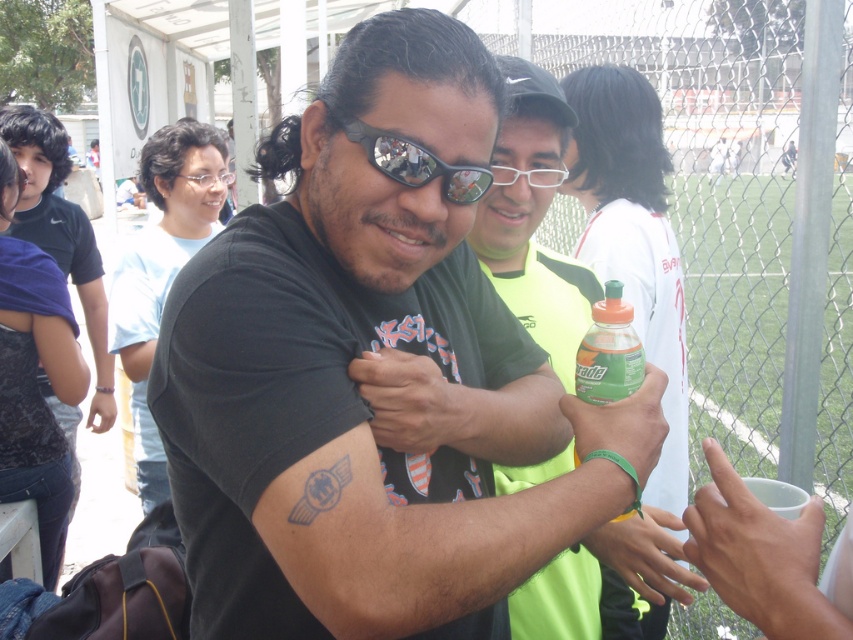
Who is positioned more to the right, green matte sports jersey at center or green matte bottle at center?

From the viewer's perspective, green matte bottle at center appears more on the right side.

Is green matte sports jersey at center closer to the viewer compared to green matte bottle at center?

That is False.

Does point (625, 593) lie in front of point (619, 365)?

No.

Locate an element on the screen. green matte sports jersey at center is located at coordinates (532, 218).

Is sunglasses at center to the left of matte black goggles at center from the viewer's perspective?

Incorrect, sunglasses at center is not on the left side of matte black goggles at center.

Can you confirm if sunglasses at center is positioned below matte black goggles at center?

Indeed, sunglasses at center is positioned under matte black goggles at center.

Where is `sunglasses at center`? The image size is (853, 640). sunglasses at center is located at coordinates (416, 163).

Can you confirm if black matte t-shirt at center is smaller than matte black goggles at center?

No, black matte t-shirt at center is not smaller than matte black goggles at center.

Between black matte t-shirt at center and matte black goggles at center, which one appears on the right side from the viewer's perspective?

Positioned to the right is black matte t-shirt at center.

Where is `black matte t-shirt at center`? The image size is (853, 640). black matte t-shirt at center is located at coordinates [358, 380].

At what (x,y) coordinates should I click in order to perform the action: click on black matte t-shirt at center. Please return your answer as a coordinate pair (x, y). This screenshot has height=640, width=853. Looking at the image, I should click on click(358, 380).